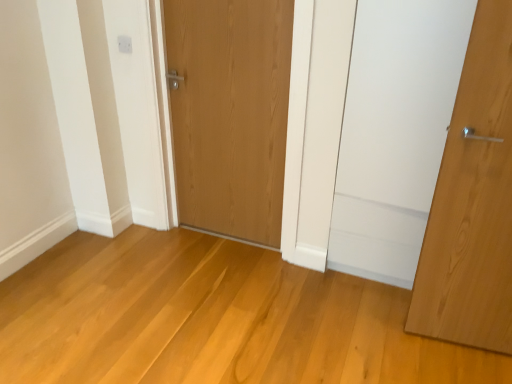
At what (x,y) coordinates should I click in order to perform the action: click on free space in front of natural wood door at right, the second door viewed from the back. Please return your answer as a coordinate pair (x, y). The height and width of the screenshot is (384, 512). Looking at the image, I should click on (463, 359).